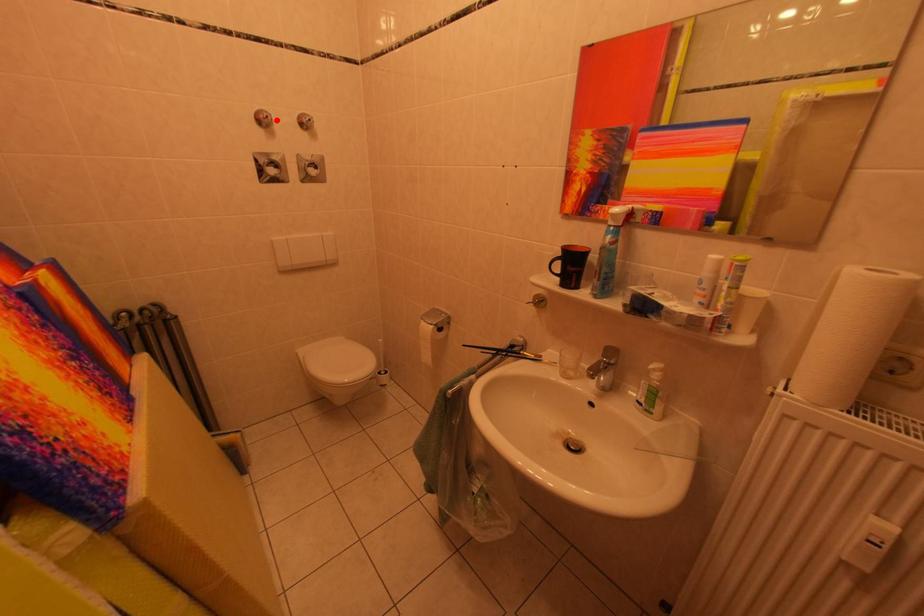
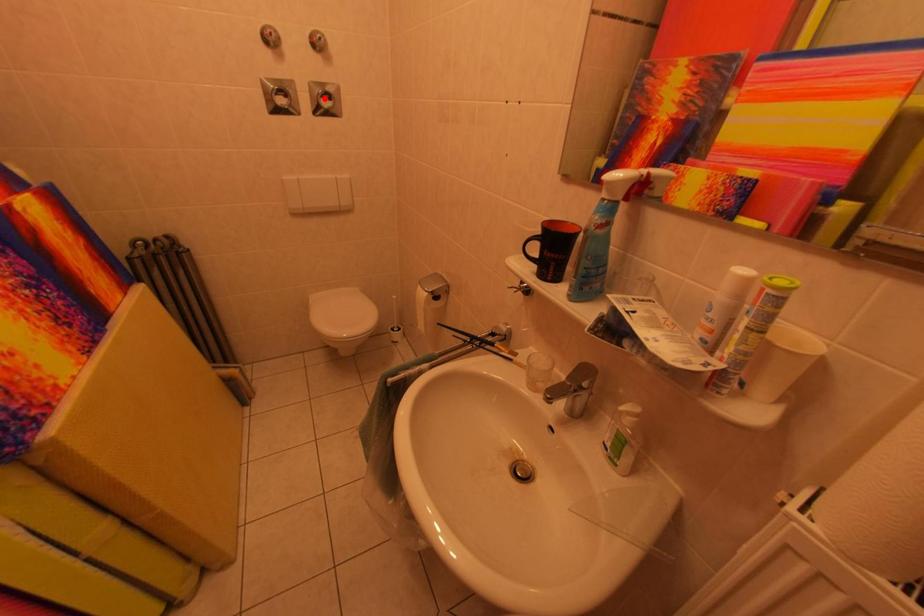
I am providing you with two images of the same scene from different viewpoints. A red point is marked on the first image and another point is marked on the second image. Does the point marked in image1 correspond to the same location as the one in image2?

No